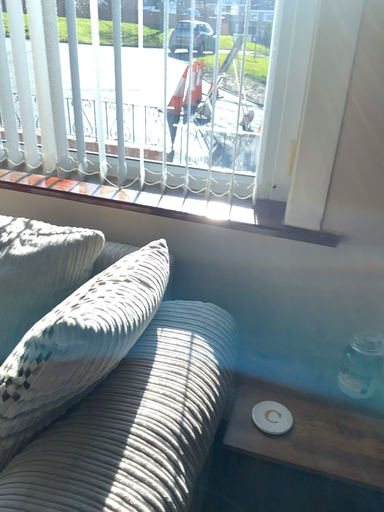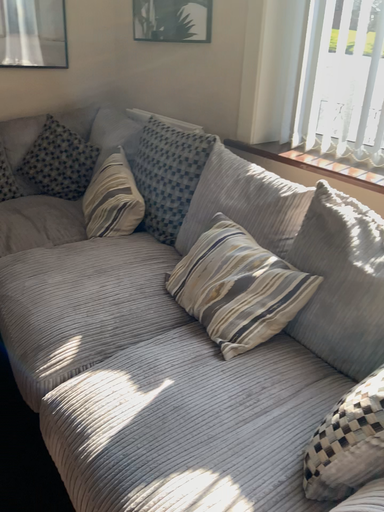
Question: Which way did the camera rotate in the video?

Choices:
 (A) rotated left
 (B) rotated right

Answer: (A)